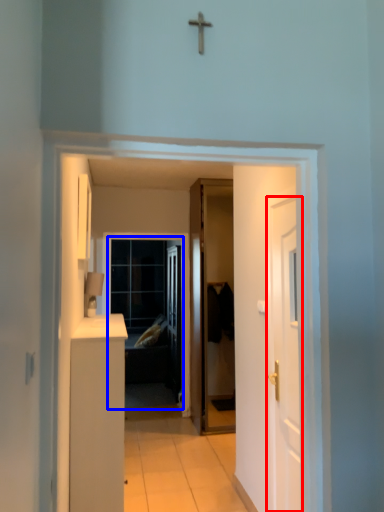
Question: Which point is closer to the camera, door (highlighted by a red box) or screen door (highlighted by a blue box)?

Choices:
 (A) door
 (B) screen door

Answer: (A)